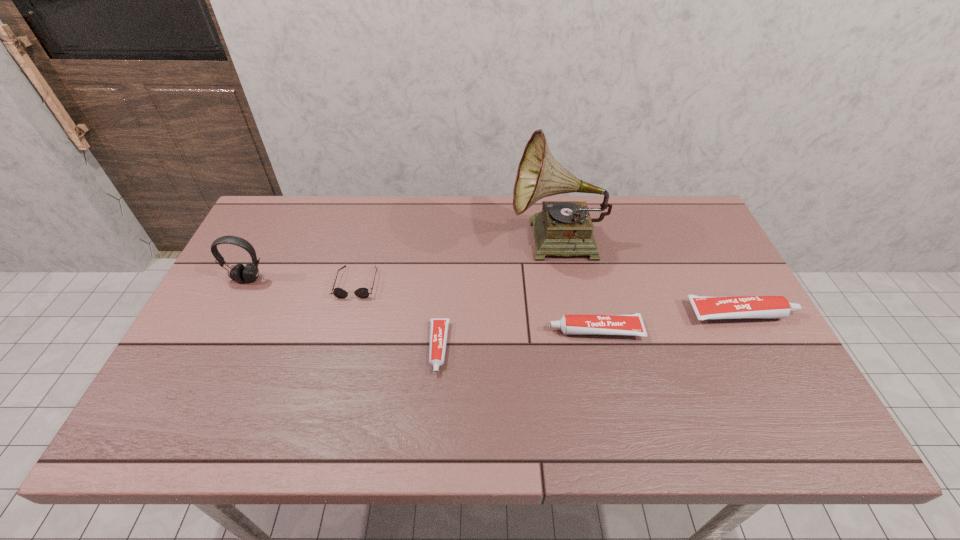
All toothpastes are currently evenly spaced. To continue this pattern, where would you add another toothpaste on the left? Please point out a vacant spot. Please provide its 2D coordinates. Your answer should be formatted as a tuple, i.e. [(x, y)], where the tuple contains the x and y coordinates of a point satisfying the conditions above.

[(271, 366)]